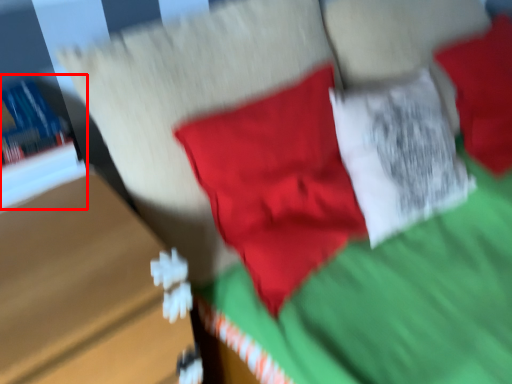
Question: From the image, what is the correct spatial relationship of book (annotated by the red box) in relation to table?

Choices:
 (A) left
 (B) right

Answer: (A)